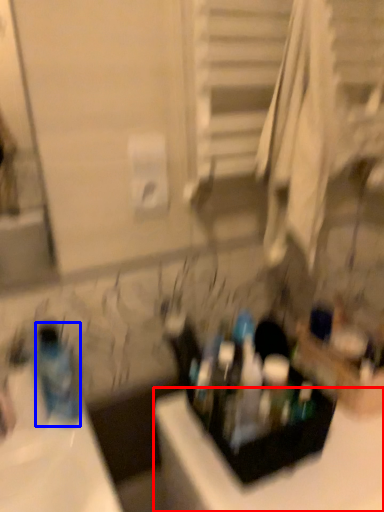
Question: Which of the following is the farthest to the observer, counter top (highlighted by a red box) or bottle (highlighted by a blue box)?

Choices:
 (A) counter top
 (B) bottle

Answer: (B)